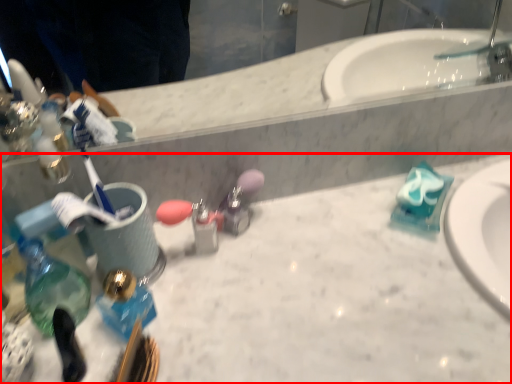
Question: From the image's perspective, considering the relative positions of counter top (annotated by the red box) and bottle in the image provided, where is counter top (annotated by the red box) located with respect to the staircase?

Choices:
 (A) above
 (B) below

Answer: (B)